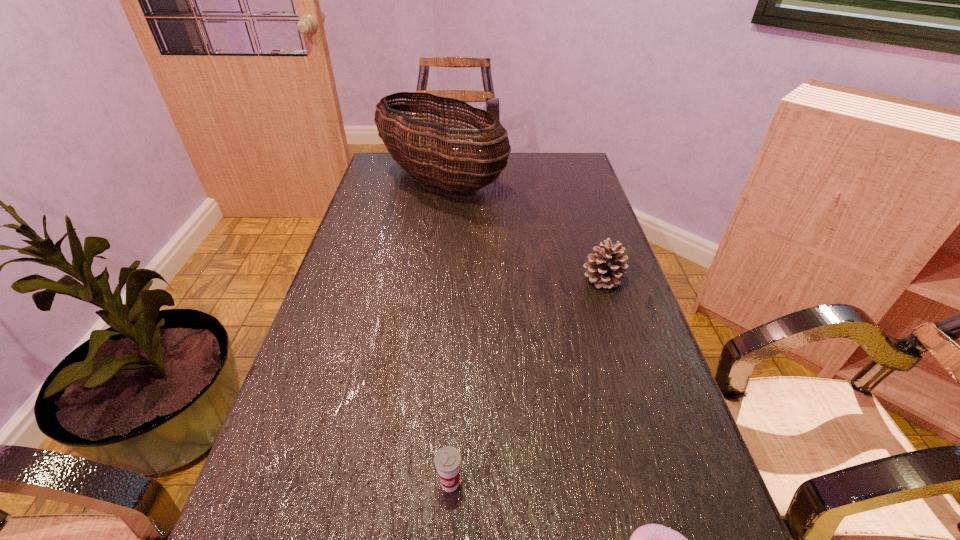
Find the location of a particular element. the farthest object is located at coordinates (405, 144).

What are the coordinates of `basket` in the screenshot? It's located at (405, 144).

Locate an element on the screen. The height and width of the screenshot is (540, 960). the second farthest object is located at coordinates (605, 268).

This screenshot has width=960, height=540. What are the coordinates of `the second nearest object` in the screenshot? It's located at (447, 459).

At what (x,y) coordinates should I click in order to perform the action: click on free spot located 0.240m on the right of the farthest object. Please return your answer as a coordinate pair (x, y). Looking at the image, I should click on (576, 179).

What are the coordinates of `vacant region located 0.100m on the back of the third nearest object` in the screenshot? It's located at (591, 244).

Find the location of `vacant area situated 0.050m on the side of the second nearest object with the logo`. vacant area situated 0.050m on the side of the second nearest object with the logo is located at coordinates (447, 529).

Find the location of a particular element. object located at the far edge is located at coordinates (405, 144).

Identify the location of object that is at the left edge. The width and height of the screenshot is (960, 540). (405, 144).

The image size is (960, 540). In order to click on object that is at the right edge in this screenshot , I will do `click(605, 268)`.